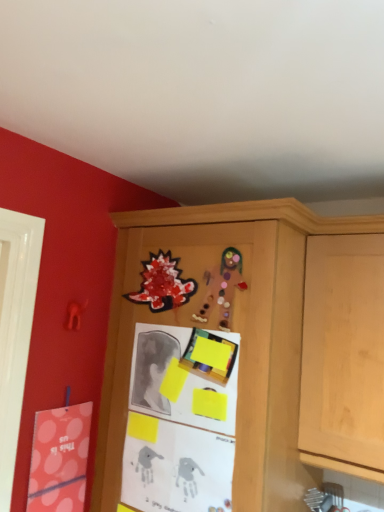
Question: Is wooden cabinet at center smaller than glittery paper dinosaur at upper center, which ranks as the 2th art in right-to-left order?

Choices:
 (A) yes
 (B) no

Answer: (B)

Question: From the image's perspective, is wooden cabinet at center over glittery paper dinosaur at upper center, which ranks as the 2th art in right-to-left order?

Choices:
 (A) no
 (B) yes

Answer: (A)

Question: Is wooden cabinet at center not inside glittery paper dinosaur at upper center, which ranks as the second art in front-to-back order?

Choices:
 (A) no
 (B) yes

Answer: (B)

Question: Could glittery paper dinosaur at upper center, acting as the 1th art starting from the back, be considered to be inside wooden cabinet at center?

Choices:
 (A) no
 (B) yes

Answer: (B)

Question: Is wooden cabinet at center turned away from glittery paper dinosaur at upper center, which ranks as the second art in front-to-back order?

Choices:
 (A) no
 (B) yes

Answer: (A)

Question: Is matte pink postcard at left inside or outside of glittery paper dinosaur at upper center, which ranks as the 2th art in right-to-left order?

Choices:
 (A) inside
 (B) outside

Answer: (B)

Question: In terms of height, does matte pink postcard at left look taller or shorter compared to glittery paper dinosaur at upper center, which ranks as the 2th art in right-to-left order?

Choices:
 (A) tall
 (B) short

Answer: (A)

Question: Visually, is matte pink postcard at left positioned to the left or to the right of glittery paper dinosaur at upper center, acting as the 1th art starting from the back?

Choices:
 (A) left
 (B) right

Answer: (A)

Question: Considering their positions, is matte pink postcard at left located in front of or behind glittery paper dinosaur at upper center, which ranks as the 2th art in right-to-left order?

Choices:
 (A) front
 (B) behind

Answer: (A)

Question: From a real-world perspective, relative to glittery paper dinosaur at upper center, which ranks as the second art in front-to-back order, is matte cardboard gingerbread man at upper center, positioned as the first art in front-to-back order, vertically above or below?

Choices:
 (A) above
 (B) below

Answer: (B)

Question: Based on their positions, is matte cardboard gingerbread man at upper center, which appears as the second art when viewed from the left, located to the left or right of glittery paper dinosaur at upper center, which ranks as the second art in front-to-back order?

Choices:
 (A) right
 (B) left

Answer: (A)

Question: Is matte cardboard gingerbread man at upper center, which appears as the second art when viewed from the left, spatially inside glittery paper dinosaur at upper center, which ranks as the 2th art in right-to-left order, or outside of it?

Choices:
 (A) inside
 (B) outside

Answer: (B)

Question: From the image's perspective, is matte cardboard gingerbread man at upper center, which appears as the second art when viewed from the left, above or below glittery paper dinosaur at upper center, acting as the 1th art starting from the back?

Choices:
 (A) above
 (B) below

Answer: (B)

Question: From the image's perspective, relative to matte pink postcard at left, is glittery paper dinosaur at upper center, acting as the 1th art starting from the back, above or below?

Choices:
 (A) below
 (B) above

Answer: (B)

Question: Is point (155, 279) closer or farther from the camera than point (38, 425)?

Choices:
 (A) closer
 (B) farther

Answer: (B)